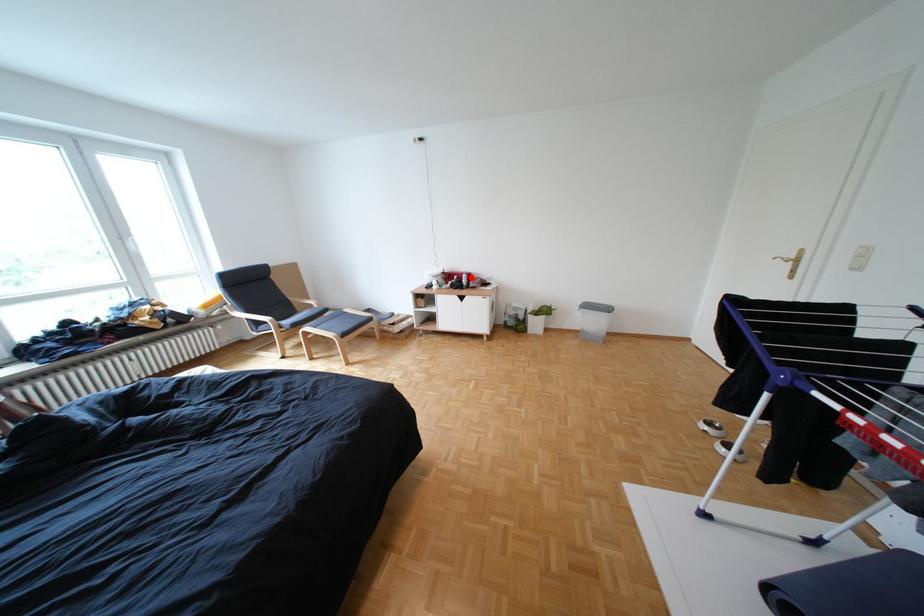
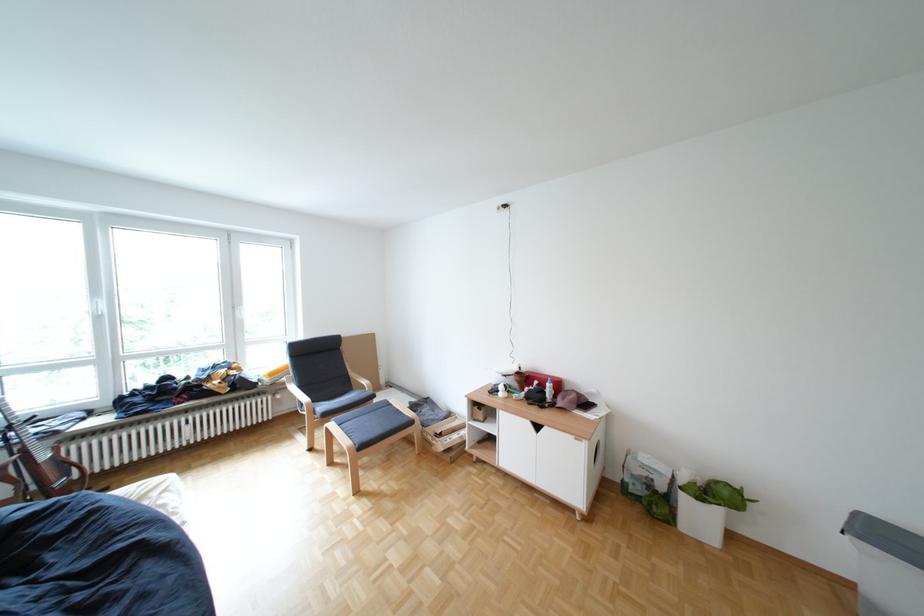
Find the pixel in the second image that matches the highlighted location in the first image.

(552, 383)